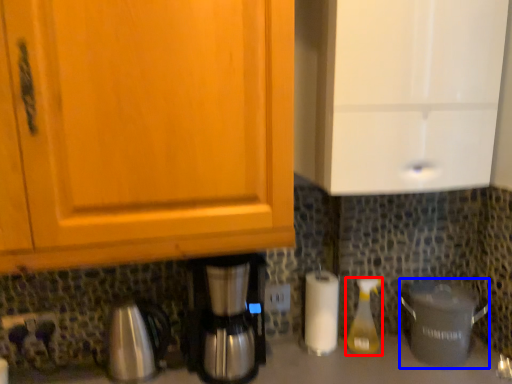
Question: Which of the following is the closest to the observer, bottle (highlighted by a red box) or crock pot (highlighted by a blue box)?

Choices:
 (A) bottle
 (B) crock pot

Answer: (B)